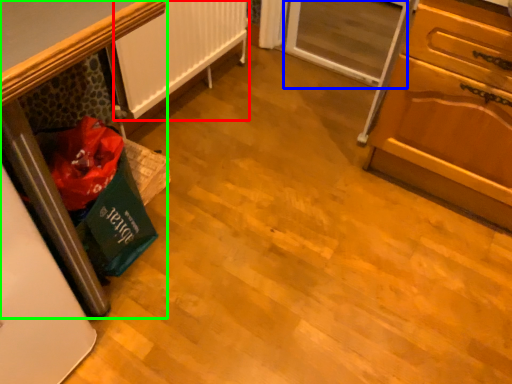
Question: Estimate the real-world distances between objects in this image. Which object is farther from radiator (highlighted by a red box), screen door (highlighted by a blue box) or furniture (highlighted by a green box)?

Choices:
 (A) screen door
 (B) furniture

Answer: (B)